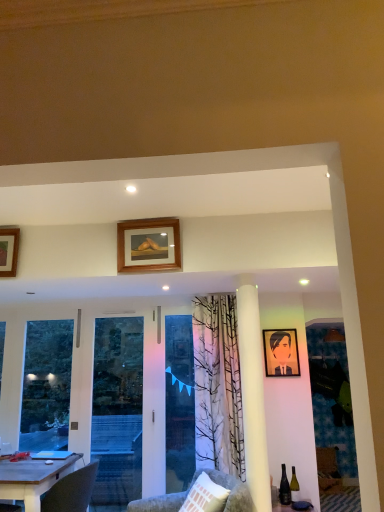
Question: From the image's perspective, is matte glass wine bottle at lower right located above or below blue fabric at center?

Choices:
 (A) below
 (B) above

Answer: (A)

Question: Which is correct: matte glass wine bottle at lower right is inside blue fabric at center, or outside of it?

Choices:
 (A) inside
 (B) outside

Answer: (B)

Question: Estimate the real-world distances between objects in this image. Which object is closer to the transparent glass screen door at left?

Choices:
 (A) wooden table at lower left
 (B) wooden picture frame at upper center, which is the 2th picture frame in right-to-left order
 (C) matte glass wine bottle at lower right
 (D) wooden picture frame at upper left, the second picture frame viewed from the top
 (E) velvet grey chair at lower center

Answer: (A)

Question: Estimate the real-world distances between objects in this image. Which object is closer to the blue fabric at center?

Choices:
 (A) wooden portrait at center, the 1th picture frame in the bottom-to-top sequence
 (B) matte glass wine bottle at lower right
 (C) transparent glass screen door at left
 (D) velvet grey chair at lower center
 (E) wooden table at lower left

Answer: (C)